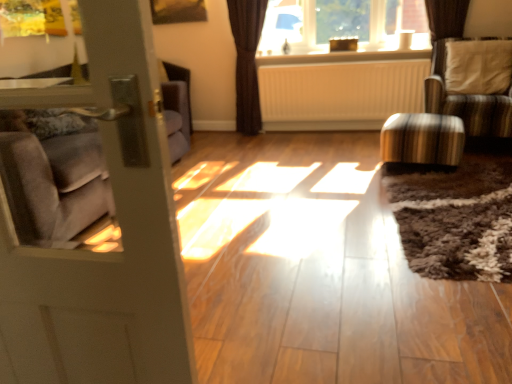
Question: Would you say white matte radiator at center is part of striped fabric chair at right's contents?

Choices:
 (A) yes
 (B) no

Answer: (B)

Question: Is striped fabric chair at right to the right of white matte radiator at center from the viewer's perspective?

Choices:
 (A) yes
 (B) no

Answer: (A)

Question: Does striped fabric chair at right appear on the left side of white matte radiator at center?

Choices:
 (A) yes
 (B) no

Answer: (B)

Question: Is striped fabric chair at right shorter than white matte radiator at center?

Choices:
 (A) no
 (B) yes

Answer: (A)

Question: Is striped fabric chair at right thinner than white matte radiator at center?

Choices:
 (A) no
 (B) yes

Answer: (A)

Question: From a real-world perspective, is striped fabric chair at right beneath white matte radiator at center?

Choices:
 (A) no
 (B) yes

Answer: (A)

Question: Is matte gray door at left further to camera compared to brown textured curtain at upper center?

Choices:
 (A) yes
 (B) no

Answer: (B)

Question: Can you confirm if matte gray door at left is shorter than brown textured curtain at upper center?

Choices:
 (A) yes
 (B) no

Answer: (A)

Question: From the image's perspective, is matte gray door at left under brown textured curtain at upper center?

Choices:
 (A) no
 (B) yes

Answer: (B)

Question: Is matte gray door at left smaller than brown textured curtain at upper center?

Choices:
 (A) yes
 (B) no

Answer: (A)

Question: Can you confirm if matte gray door at left is wider than brown textured curtain at upper center?

Choices:
 (A) no
 (B) yes

Answer: (A)

Question: Considering the relative sizes of matte gray door at left and brown textured curtain at upper center in the image provided, is matte gray door at left taller than brown textured curtain at upper center?

Choices:
 (A) no
 (B) yes

Answer: (A)

Question: Does white textured pillow at upper right have a greater width compared to striped fabric chair at right?

Choices:
 (A) yes
 (B) no

Answer: (B)